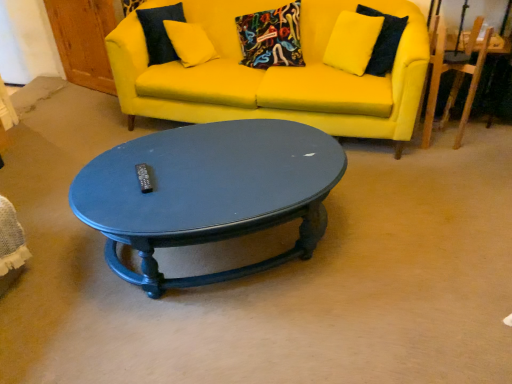
This screenshot has width=512, height=384. I want to click on vacant area on top of glossy dark blue coffee table at center (from a real-world perspective), so click(216, 162).